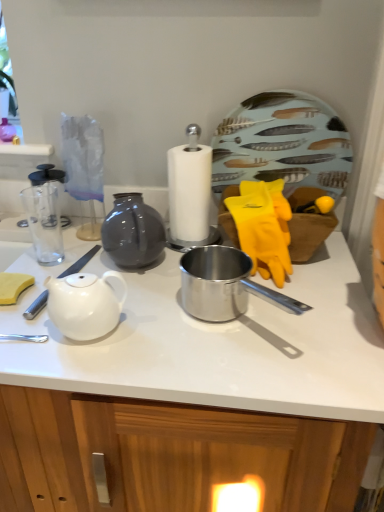
Question: Is point (306, 394) positioned closer to the camera than point (347, 137)?

Choices:
 (A) closer
 (B) farther

Answer: (A)

Question: Choose the correct answer: Is white glossy teapot at center-left inside feather-patterned ceramic plate at upper right or outside it?

Choices:
 (A) outside
 (B) inside

Answer: (A)

Question: Which is nearer to the white glossy teapot at left?

Choices:
 (A) feather-patterned ceramic plate at upper right
 (B) white glossy teapot at center-left

Answer: (B)

Question: Considering the real-world distances, which object is farthest from the white glossy teapot at center-left?

Choices:
 (A) white glossy teapot at left
 (B) feather-patterned ceramic plate at upper right

Answer: (B)